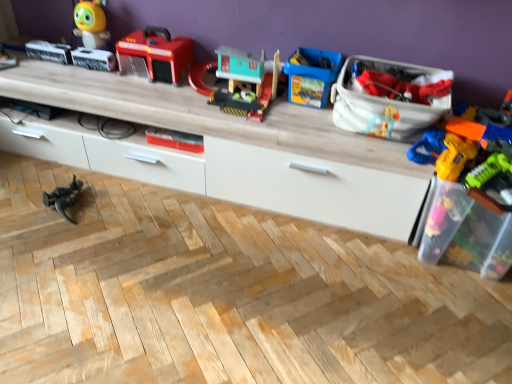
The height and width of the screenshot is (384, 512). I want to click on spots to the right of black plastic dinosaur at lower left, which is the first toy from left to right, so click(115, 205).